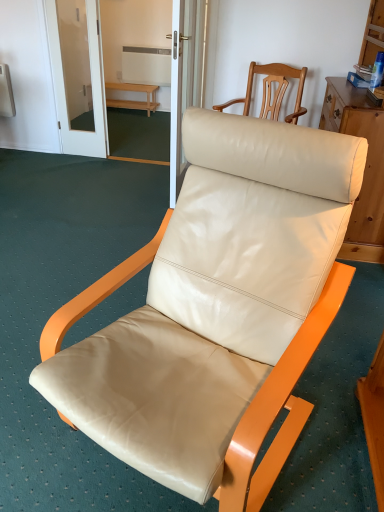
What do you see at coordinates (133, 100) in the screenshot? I see `light wood bench at center` at bounding box center [133, 100].

You are a GUI agent. You are given a task and a screenshot of the screen. Output one action in this format:
    pyautogui.click(x=<x>, y=<y>)
    Task: Click on the beige leather chair at upper right, the second chair positioned from the front
    The height and width of the screenshot is (512, 384).
    Given the screenshot: What is the action you would take?
    pyautogui.click(x=270, y=90)

The image size is (384, 512). I want to click on transparent glass screen door at upper center, so pos(65,91).

Locate an element on the screen. The width and height of the screenshot is (384, 512). beige leather chair at center, which is the second chair in back-to-front order is located at coordinates (217, 311).

Locate an element on the screen. light wood bench at center is located at coordinates (133, 100).

Are transparent glass screen door at upper center and beige leather chair at center, the first chair in the bottom-to-top sequence, located far from each other?

Yes, transparent glass screen door at upper center is far from beige leather chair at center, the first chair in the bottom-to-top sequence.

Who is taller, transparent glass screen door at upper center or beige leather chair at center, which is the second chair in back-to-front order?

With more height is transparent glass screen door at upper center.

Does point (93, 46) lie in front of point (202, 418)?

No, (93, 46) is further to viewer.

Looking at their sizes, would you say transparent glass screen door at upper center is wider or thinner than beige leather chair at center, the first chair in the bottom-to-top sequence?

transparent glass screen door at upper center is thinner than beige leather chair at center, the first chair in the bottom-to-top sequence.

Which object is closer to the camera, transparent glass screen door at upper center or light wood bench at center?

transparent glass screen door at upper center is in front.

Is point (55, 78) positioned after point (109, 101)?

No, (55, 78) is in front of (109, 101).

Find the location of `furniture below the transparent glass screen door at upper center (from the image's perspective)`. furniture below the transparent glass screen door at upper center (from the image's perspective) is located at coordinates (133, 100).

Can we say transparent glass screen door at upper center lies outside light wood bench at center?

Absolutely, transparent glass screen door at upper center is external to light wood bench at center.

Considering the positions of point (81, 356) and point (47, 19), is point (81, 356) closer or farther from the camera than point (47, 19)?

Point (81, 356).

In the image, there is a beige leather chair at center, which is counted as the 2th chair, starting from the top. Where is `screen door above it (from the image's perspective)`? This screenshot has height=512, width=384. screen door above it (from the image's perspective) is located at coordinates (65, 91).

From the picture: From a real-world perspective, which is physically below, beige leather chair at center, which is counted as the 2th chair, starting from the top, or transparent glass screen door at upper center?

beige leather chair at center, which is counted as the 2th chair, starting from the top, is physically lower.

Does beige leather chair at center, the 1th chair from the front, have a larger size compared to transparent glass screen door at upper center?

Yes, beige leather chair at center, the 1th chair from the front, is bigger than transparent glass screen door at upper center.

Is beige leather chair at center, which is the second chair in back-to-front order, smaller than beige leather chair at upper right, arranged as the 2th chair when ordered from the bottom?

Incorrect, beige leather chair at center, which is the second chair in back-to-front order, is not smaller in size than beige leather chair at upper right, arranged as the 2th chair when ordered from the bottom.

Is beige leather chair at upper right, positioned as the 1th chair in top-to-bottom order, at the back of beige leather chair at center, which is the second chair in back-to-front order?

Absolutely, beige leather chair at center, which is the second chair in back-to-front order, is directed away from beige leather chair at upper right, positioned as the 1th chair in top-to-bottom order.

Where is `chair on the left of beige leather chair at upper right, arranged as the 2th chair when ordered from the bottom`? This screenshot has width=384, height=512. chair on the left of beige leather chair at upper right, arranged as the 2th chair when ordered from the bottom is located at coordinates (x=217, y=311).

Considering the sizes of objects beige leather chair at center, which is counted as the 2th chair, starting from the top, and beige leather chair at upper right, which is counted as the 1th chair, starting from the back, in the image provided, who is taller, beige leather chair at center, which is counted as the 2th chair, starting from the top, or beige leather chair at upper right, which is counted as the 1th chair, starting from the back,?

beige leather chair at center, which is counted as the 2th chair, starting from the top.

How distant is beige leather chair at center, the first chair in the bottom-to-top sequence, from light wood bench at center?

A distance of 14.51 feet exists between beige leather chair at center, the first chair in the bottom-to-top sequence, and light wood bench at center.

From the image's perspective, which one is positioned lower, beige leather chair at center, the first chair in the bottom-to-top sequence, or light wood bench at center?

beige leather chair at center, the first chair in the bottom-to-top sequence, from the image's perspective.

Locate an element on the screen. This screenshot has height=512, width=384. the 2nd chair in front of the light wood bench at center is located at coordinates (217, 311).

Is the depth of beige leather chair at center, the 1th chair from the front, less than that of light wood bench at center?

Yes, beige leather chair at center, the 1th chair from the front, is closer to the viewer.

Which is in front, point (135, 87) or point (57, 69)?

The point (57, 69) is closer to the camera.

From a real-world perspective, which object rests below the other?

light wood bench at center.

Considering the positions of objects light wood bench at center and transparent glass screen door at upper center in the image provided, who is more to the left, light wood bench at center or transparent glass screen door at upper center?

From the viewer's perspective, transparent glass screen door at upper center appears more on the left side.

From the picture: Would you say light wood bench at center is a long distance from transparent glass screen door at upper center?

Yes, light wood bench at center and transparent glass screen door at upper center are located far from each other.

Could light wood bench at center be considered to be inside beige leather chair at upper right, arranged as the 2th chair when ordered from the bottom?

No.

Which object is closer to the camera, beige leather chair at upper right, arranged as the 2th chair when ordered from the bottom, or light wood bench at center?

beige leather chair at upper right, arranged as the 2th chair when ordered from the bottom, is in front.

Between beige leather chair at upper right, which is counted as the 1th chair, starting from the back, and light wood bench at center, which one has more height?

Standing taller between the two is beige leather chair at upper right, which is counted as the 1th chair, starting from the back.

Is beige leather chair at upper right, which is counted as the 1th chair, starting from the back, wider than light wood bench at center?

Indeed, beige leather chair at upper right, which is counted as the 1th chair, starting from the back, has a greater width compared to light wood bench at center.

Where is `the 1st chair counting from the right side of the transparent glass screen door at upper center`? the 1st chair counting from the right side of the transparent glass screen door at upper center is located at coordinates (217, 311).

Find the location of a particular element. screen door above the light wood bench at center (from a real-world perspective) is located at coordinates (65, 91).

When comparing their distances from transparent glass screen door at upper center, does beige leather chair at center, the 1th chair from the front, or beige leather chair at upper right, the second chair positioned from the front, seem further?

Based on the image, beige leather chair at center, the 1th chair from the front, appears to be further to transparent glass screen door at upper center.

From the image, which object appears to be nearer to beige leather chair at center, which is counted as the 2th chair, starting from the top, light wood bench at center or transparent glass screen door at upper center?

transparent glass screen door at upper center lies closer to beige leather chair at center, which is counted as the 2th chair, starting from the top, than the other object.

From the image, which object appears to be farther from light wood bench at center, beige leather chair at upper right, which is counted as the 1th chair, starting from the back, or transparent glass screen door at upper center?

The object further to light wood bench at center is beige leather chair at upper right, which is counted as the 1th chair, starting from the back.

From the image, which object appears to be farther from beige leather chair at upper right, arranged as the 2th chair when ordered from the bottom, beige leather chair at center, the first chair in the bottom-to-top sequence, or light wood bench at center?

light wood bench at center is further to beige leather chair at upper right, arranged as the 2th chair when ordered from the bottom.

Based on their spatial positions, is beige leather chair at upper right, arranged as the 2th chair when ordered from the bottom, or beige leather chair at center, which is counted as the 2th chair, starting from the top, closer to transparent glass screen door at upper center?

The object closer to transparent glass screen door at upper center is beige leather chair at upper right, arranged as the 2th chair when ordered from the bottom.

Looking at the image, which one is located further to transparent glass screen door at upper center, beige leather chair at upper right, positioned as the 1th chair in top-to-bottom order, or light wood bench at center?

light wood bench at center is positioned further to the anchor transparent glass screen door at upper center.

When comparing their distances from beige leather chair at center, the first chair in the bottom-to-top sequence, does beige leather chair at upper right, positioned as the 1th chair in top-to-bottom order, or transparent glass screen door at upper center seem closer?

The object closer to beige leather chair at center, the first chair in the bottom-to-top sequence, is beige leather chair at upper right, positioned as the 1th chair in top-to-bottom order.

Based on the photo, looking at the image, which one is located closer to beige leather chair at center, the first chair in the bottom-to-top sequence, transparent glass screen door at upper center or light wood bench at center?

Based on the image, transparent glass screen door at upper center appears to be nearer to beige leather chair at center, the first chair in the bottom-to-top sequence.

Find the location of a particular element. chair located between beige leather chair at center, which is the second chair in back-to-front order, and light wood bench at center in the depth direction is located at coordinates point(270,90).

Locate an element on the screen. Image resolution: width=384 pixels, height=512 pixels. screen door positioned between beige leather chair at center, which is counted as the 2th chair, starting from the top, and light wood bench at center from near to far is located at coordinates (65, 91).

I want to click on screen door positioned between beige leather chair at upper right, positioned as the 1th chair in top-to-bottom order, and light wood bench at center from near to far, so click(65, 91).

Where is `chair positioned between beige leather chair at center, which is the second chair in back-to-front order, and transparent glass screen door at upper center from near to far`? The height and width of the screenshot is (512, 384). chair positioned between beige leather chair at center, which is the second chair in back-to-front order, and transparent glass screen door at upper center from near to far is located at coordinates (270, 90).